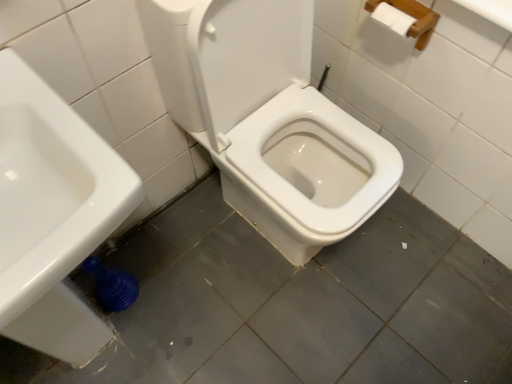
Locate an element on the screen. Image resolution: width=512 pixels, height=384 pixels. unoccupied region to the right of white glossy toilet at center is located at coordinates (422, 267).